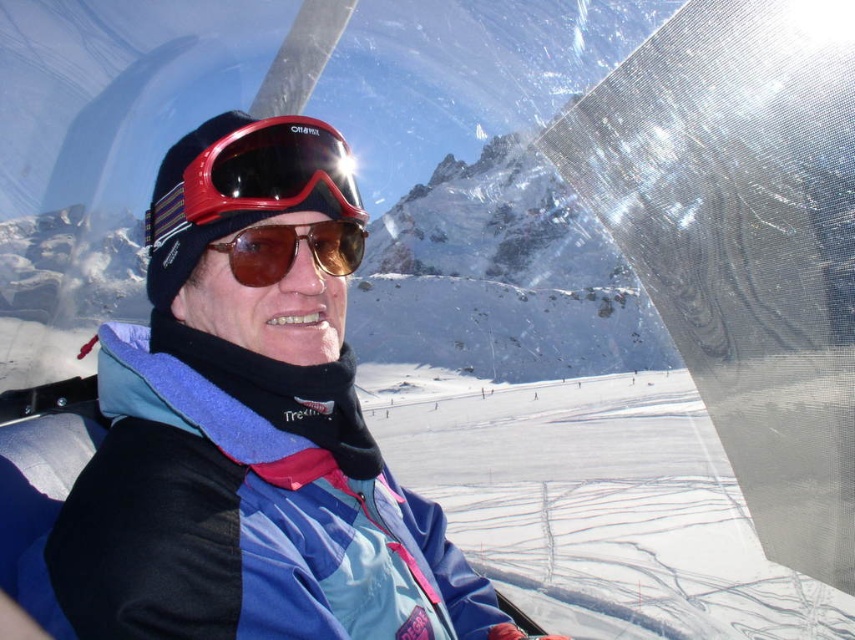
Based on the photo, you are designing a virtual reality simulation of the ski lift cabin scene. To accurately place the glossy red ski goggles at center in the VR environment, what are their coordinates?

The glossy red ski goggles at center are located at coordinates (270, 170) in the 2D space of the scene.